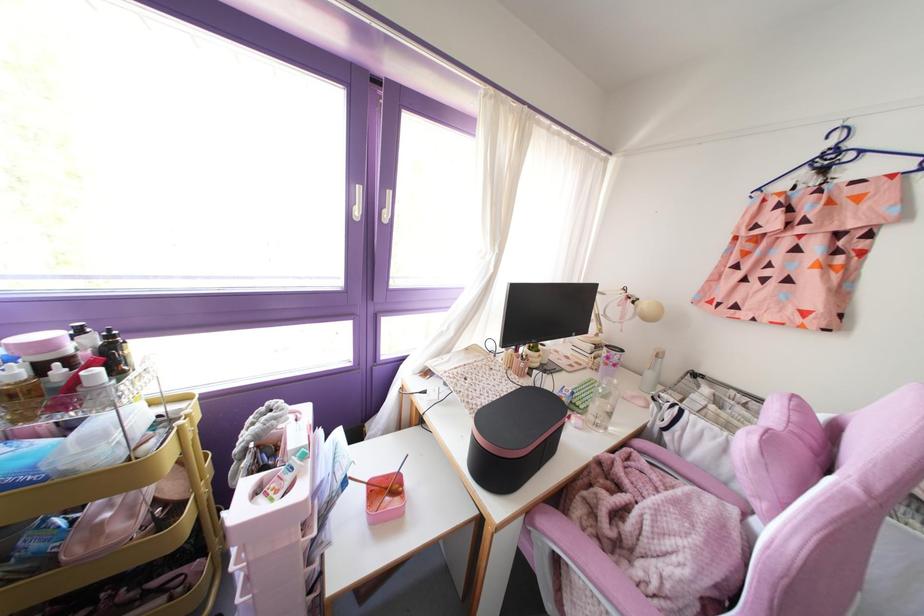
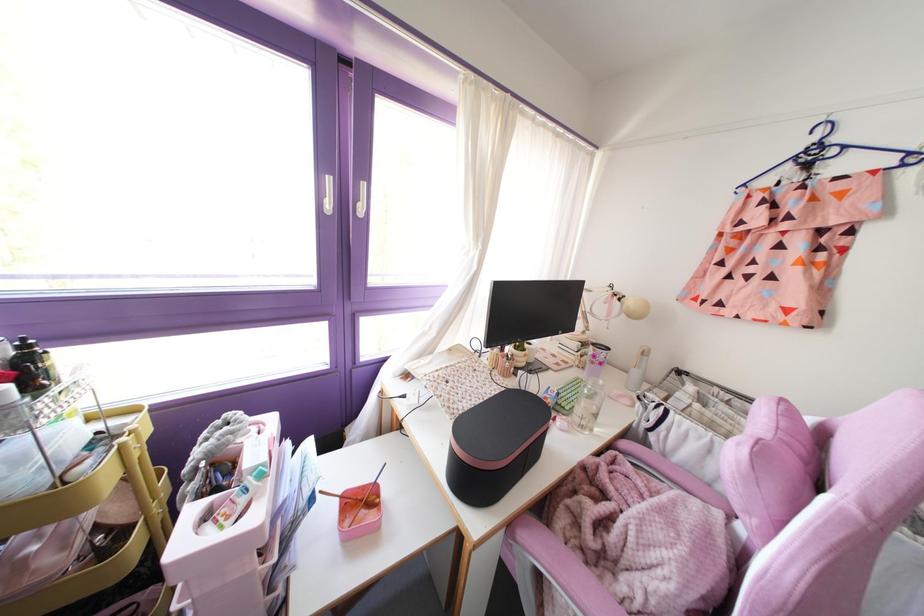
The point at (302, 456) is marked in the first image. Where is the corresponding point in the second image?

(261, 475)